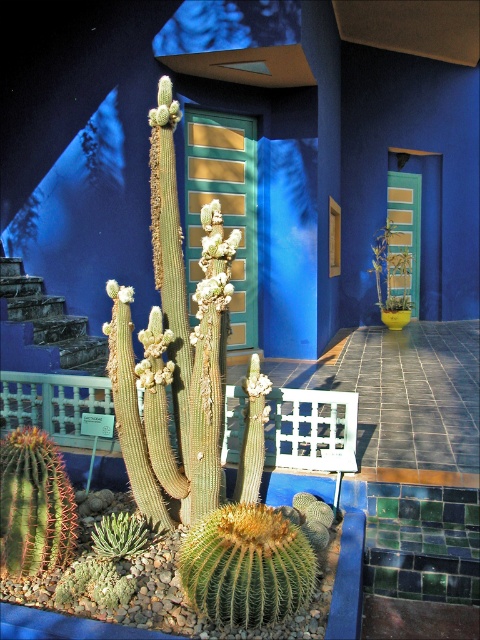
Question: Does succulent spiny at center appear under green leafy plant at center?

Choices:
 (A) yes
 (B) no

Answer: (A)

Question: Which point is farther from the camera taking this photo?

Choices:
 (A) (7, 444)
 (B) (397, 262)
 (C) (212, 401)

Answer: (B)

Question: Which object is farther from the camera taking this photo?

Choices:
 (A) green fuzzy cactus at lower left
 (B) succulent spiny at center

Answer: (B)

Question: Is succulent spiny at center smaller than green spiky cactus at lower center?

Choices:
 (A) no
 (B) yes

Answer: (A)

Question: Can you confirm if succulent spiny at center is positioned below green succulent at lower left?

Choices:
 (A) no
 (B) yes

Answer: (A)

Question: Which object is positioned closest to the succulent spiny at center?

Choices:
 (A) green leafy plant at center
 (B) green spiny cactus at lower left

Answer: (B)